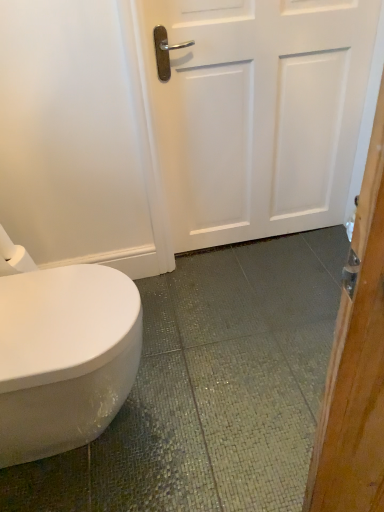
Question: In terms of size, does white matte door at center appear bigger or smaller than white matte toilet paper at left?

Choices:
 (A) small
 (B) big

Answer: (B)

Question: Is white matte door at center inside the boundaries of white matte toilet paper at left, or outside?

Choices:
 (A) inside
 (B) outside

Answer: (B)

Question: Considering the positions of point (261, 174) and point (33, 263), is point (261, 174) closer or farther from the camera than point (33, 263)?

Choices:
 (A) closer
 (B) farther

Answer: (B)

Question: Is point (6, 243) positioned closer to the camera than point (263, 159)?

Choices:
 (A) closer
 (B) farther

Answer: (A)

Question: Looking at the image, does white matte toilet paper at left seem bigger or smaller compared to white matte door at center?

Choices:
 (A) big
 (B) small

Answer: (B)

Question: Relative to white matte door at center, is white matte toilet paper at left in front or behind?

Choices:
 (A) behind
 (B) front

Answer: (B)

Question: Would you say white matte toilet paper at left is inside or outside white matte door at center?

Choices:
 (A) outside
 (B) inside

Answer: (A)